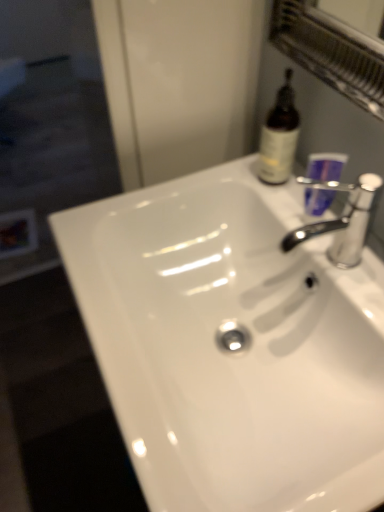
The image size is (384, 512). What are the coordinates of `vacant area that lies in front of purple plastic cup at upper right` in the screenshot? It's located at (345, 269).